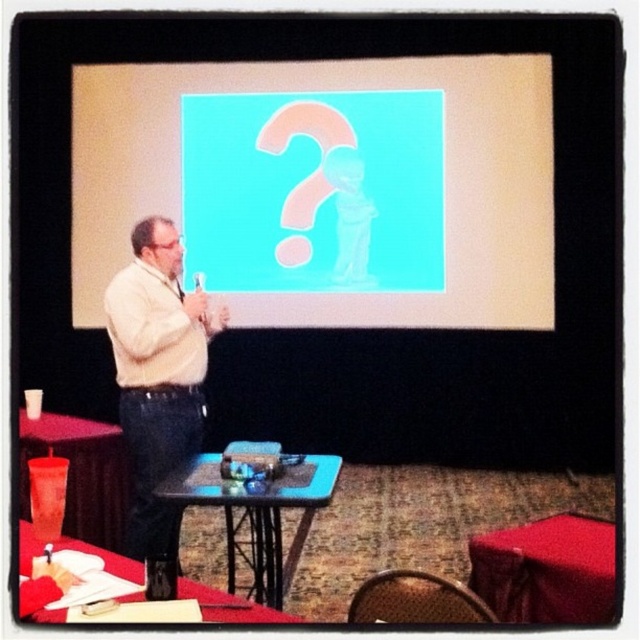
Question: Observing the image, what is the correct spatial positioning of red fabric table at lower right in reference to red plastic table at lower left?

Choices:
 (A) left
 (B) right

Answer: (B)

Question: Does red fabric table at lower right appear under smooth wood table at lower left?

Choices:
 (A) yes
 (B) no

Answer: (A)

Question: Which object is positioned farthest from the blue matte projection screen at center?

Choices:
 (A) red plastic table at lower left
 (B) beige sweater at center
 (C) smooth wood table at lower left

Answer: (C)

Question: Can you confirm if beige sweater at center is wider than red fabric table at lower right?

Choices:
 (A) yes
 (B) no

Answer: (B)

Question: Which object is positioned closest to the red fabric table at lower right?

Choices:
 (A) blue plastic table at center
 (B) blue matte projection screen at center
 (C) beige sweater at center

Answer: (A)

Question: Which object is the farthest from the smooth wood table at lower left?

Choices:
 (A) blue plastic table at center
 (B) red plastic table at lower left
 (C) red fabric table at lower right

Answer: (B)